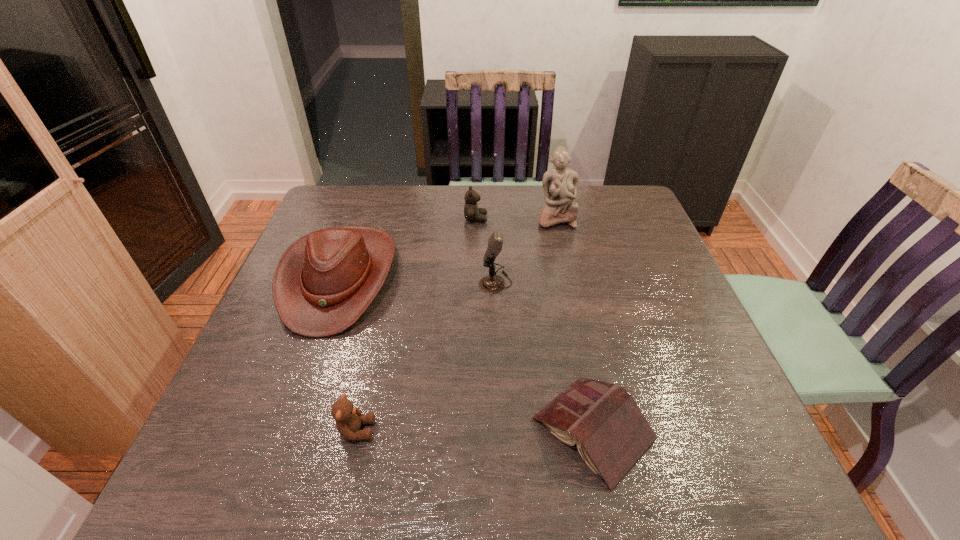
The height and width of the screenshot is (540, 960). What are the coordinates of `the tallest object` in the screenshot? It's located at (560, 185).

Where is `the fifth shortest object`? the fifth shortest object is located at coordinates (491, 284).

Locate an element on the screen. The height and width of the screenshot is (540, 960). cowboy hat is located at coordinates (323, 283).

The image size is (960, 540). Identify the location of the right teddy bear. (471, 211).

I want to click on the taller teddy bear, so click(x=471, y=211).

Find the location of `the fifth tallest object`. the fifth tallest object is located at coordinates (348, 418).

Image resolution: width=960 pixels, height=540 pixels. In order to click on the shorter teddy bear in this screenshot , I will do `click(348, 418)`.

At what (x,y) coordinates should I click in order to perform the action: click on book. Please return your answer as a coordinate pair (x, y). This screenshot has width=960, height=540. Looking at the image, I should click on (611, 433).

This screenshot has width=960, height=540. Identify the location of vacant area situated on the front-facing side of the tallest object. (567, 272).

You are a GUI agent. You are given a task and a screenshot of the screen. Output one action in this format:
    pyautogui.click(x=<x>, y=<y>)
    Task: Click on the vacant area located on the front-facing side of the microphone
    Image resolution: width=960 pixels, height=540 pixels.
    Given the screenshot: What is the action you would take?
    tap(413, 282)